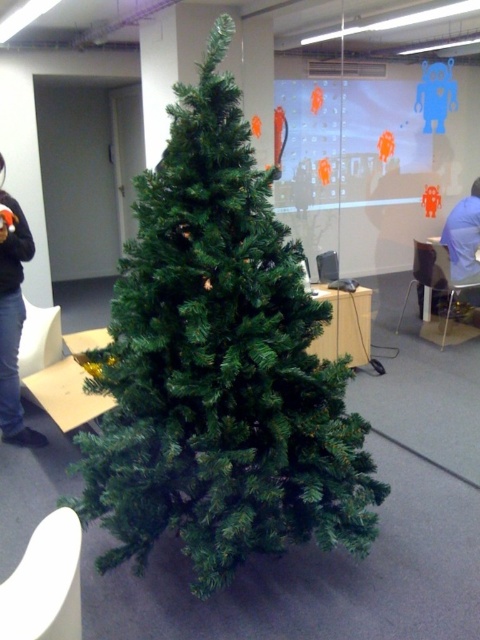
Based on the photo, who is positioned more to the left, black sweater at left or blue fabric shirt at right?

From the viewer's perspective, black sweater at left appears more on the left side.

Consider the image. Who is positioned more to the right, black sweater at left or blue fabric shirt at right?

Answer: Positioned to the right is blue fabric shirt at right.

Who is more forward, [20,300] or [469,256]?

Point [20,300] is more forward.

Locate an element on the screen. This screenshot has height=640, width=480. black sweater at left is located at coordinates (12, 324).

Who is shorter, green matte christmas tree at center or blue fabric shirt at right?

Standing shorter between the two is blue fabric shirt at right.

The height and width of the screenshot is (640, 480). What do you see at coordinates (218, 365) in the screenshot?
I see `green matte christmas tree at center` at bounding box center [218, 365].

The height and width of the screenshot is (640, 480). What are the coordinates of `green matte christmas tree at center` in the screenshot? It's located at (218, 365).

Who is more distant from viewer, (228, 84) or (2, 422)?

Point (2, 422)

Which of these two, green matte christmas tree at center or black sweater at left, stands shorter?

With less height is black sweater at left.

Is point (194, 209) less distant than point (19, 401)?

That is True.

The width and height of the screenshot is (480, 640). Identify the location of green matte christmas tree at center. (218, 365).